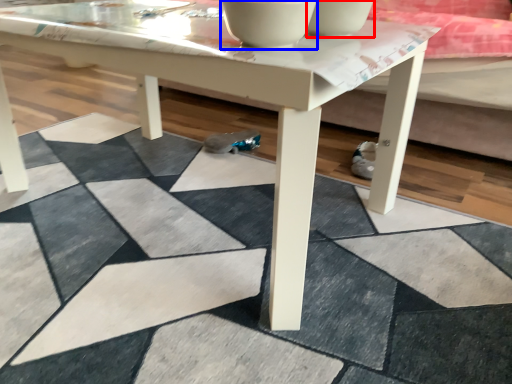
Question: Which object is further to the camera taking this photo, bowl (highlighted by a red box) or bowl (highlighted by a blue box)?

Choices:
 (A) bowl
 (B) bowl

Answer: (A)